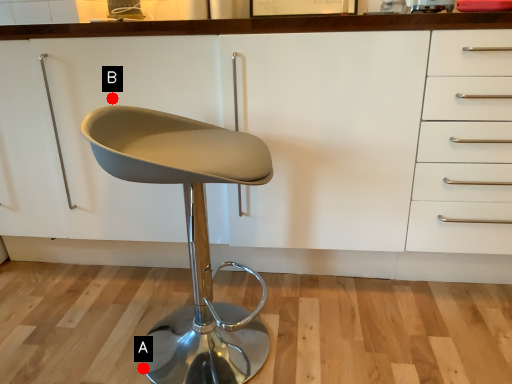
Question: Two points are circled on the image, labeled by A and B beside each circle. Which point is farther to the camera?

Choices:
 (A) A is further
 (B) B is further

Answer: (A)